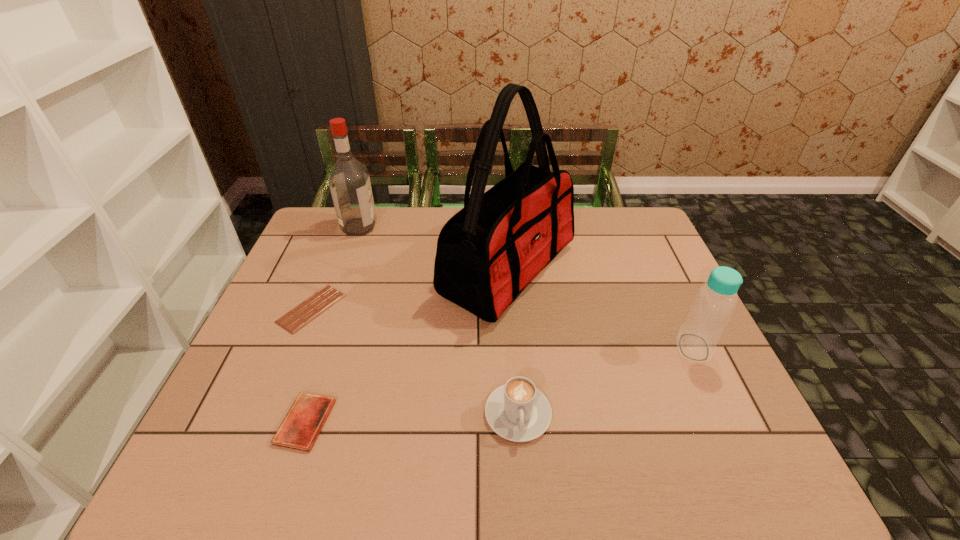
This screenshot has width=960, height=540. What are the coordinates of `duffel bag` in the screenshot? It's located at tap(487, 253).

The height and width of the screenshot is (540, 960). I want to click on liquor, so click(x=349, y=181).

What are the coordinates of `the rightmost object` in the screenshot? It's located at (715, 301).

Locate an element on the screen. The height and width of the screenshot is (540, 960). bottle is located at coordinates (715, 301).

Image resolution: width=960 pixels, height=540 pixels. In order to click on cappuccino in this screenshot , I will do `click(517, 411)`.

This screenshot has height=540, width=960. In order to click on the fifth tallest object in this screenshot , I will do `click(300, 428)`.

This screenshot has width=960, height=540. What are the coordinates of `chocolate bar` in the screenshot? It's located at [308, 310].

You are a GUI agent. You are given a task and a screenshot of the screen. Output one action in this format:
    pyautogui.click(x=<x>, y=<y>)
    Task: Click on the vacant space located on the front of the duffel bag
    Image resolution: width=960 pixels, height=540 pixels.
    Given the screenshot: What is the action you would take?
    pyautogui.click(x=521, y=459)

Image resolution: width=960 pixels, height=540 pixels. What are the coordinates of `free region located 0.090m on the front-facing side of the liquor` in the screenshot? It's located at (402, 226).

Locate an element on the screen. The height and width of the screenshot is (540, 960). free location located 0.210m on the front of the rightmost object is located at coordinates (742, 449).